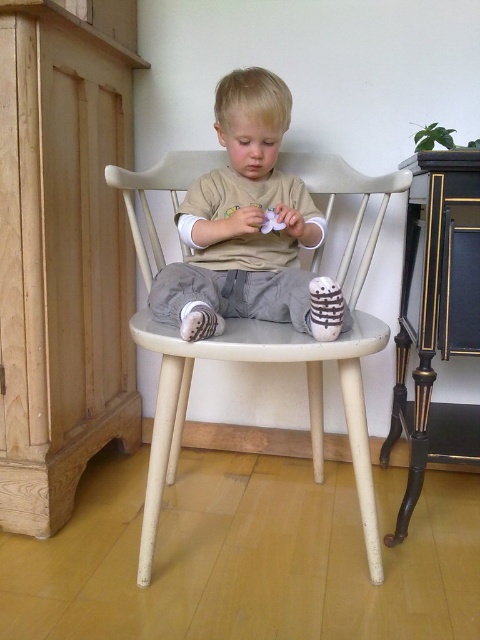
Question: Among these points, which one is farthest from the camera?

Choices:
 (A) (319, 289)
 (B) (192, 294)
 (C) (348, 424)

Answer: (B)

Question: Does white painted wood chair at center have a greater width compared to white striped socks at lower center?

Choices:
 (A) no
 (B) yes

Answer: (B)

Question: Which object is closer to the camera taking this photo?

Choices:
 (A) white matte plush toy at center
 (B) white striped socks at lower center

Answer: (B)

Question: Which point is farther from the camera taking this photo?

Choices:
 (A) pos(236,200)
 (B) pos(137,323)
 (C) pos(261,227)

Answer: (A)

Question: Is matte beige shirt at center wider than white striped socks at lower center?

Choices:
 (A) no
 (B) yes

Answer: (B)

Question: Does white painted wood chair at center appear over white matte plush toy at center?

Choices:
 (A) yes
 (B) no

Answer: (B)